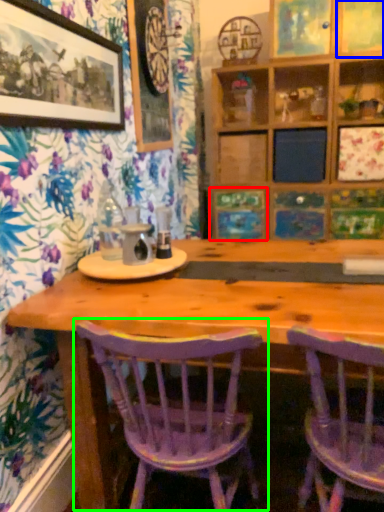
Question: Considering the real-world distances, which object is farthest from decorative picture (highlighted by a red box)? picture frame (highlighted by a blue box) or chair (highlighted by a green box)?

Choices:
 (A) picture frame
 (B) chair

Answer: (B)